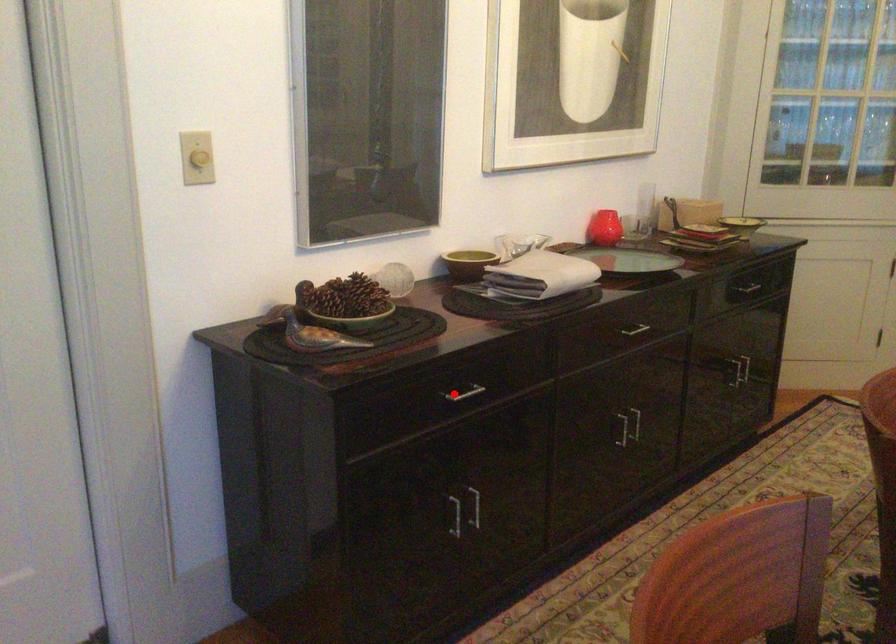
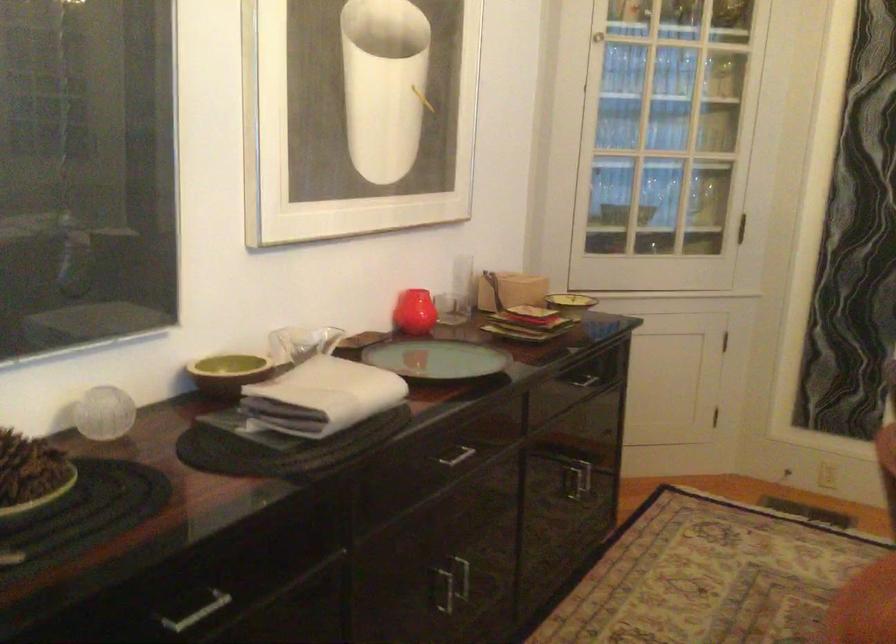
The point at the highlighted location is marked in the first image. Where is the corresponding point in the second image?

(194, 609)